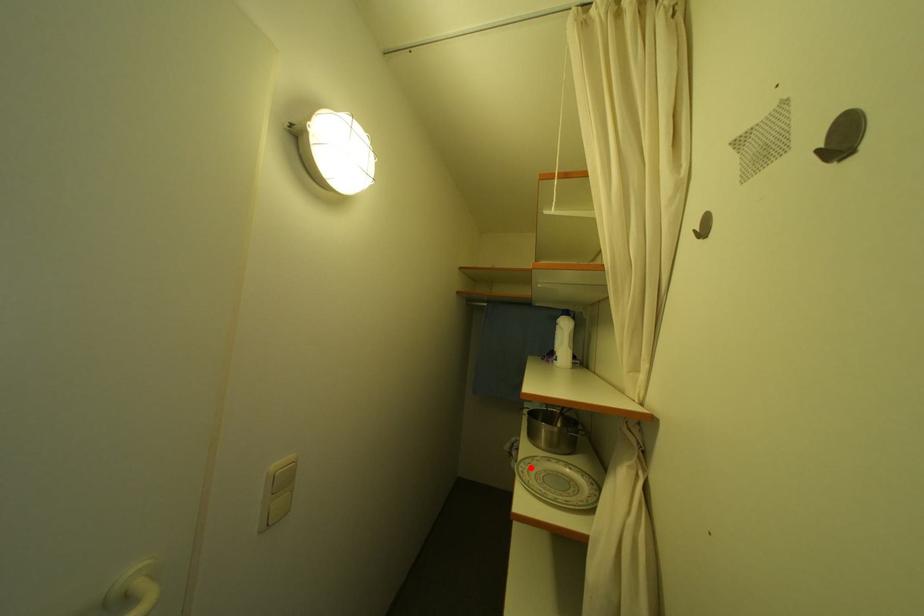
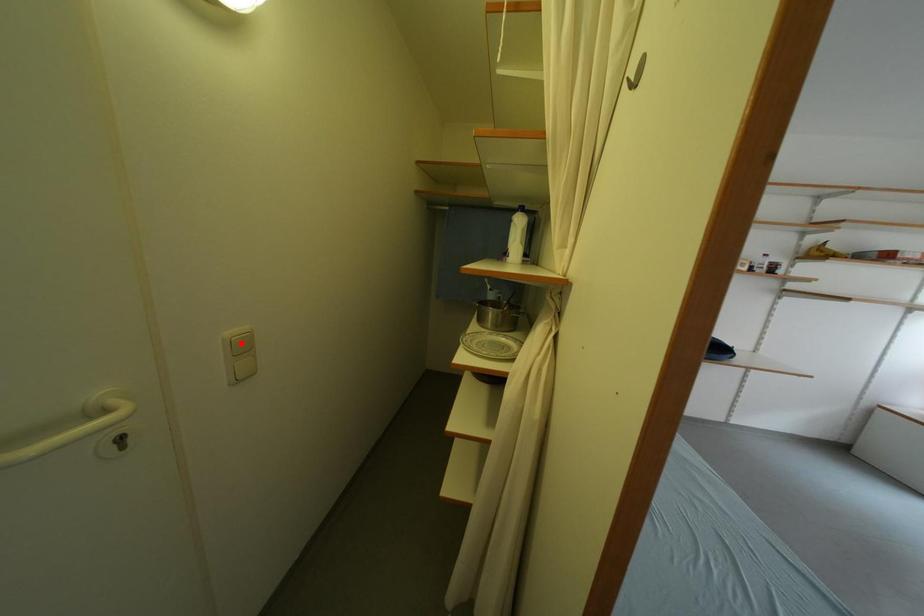
I am providing you with two images of the same scene from different viewpoints. A red point is marked on the first image and another point is marked on the second image. Are the points marked in image1 and image2 representing the same 3D position?

No